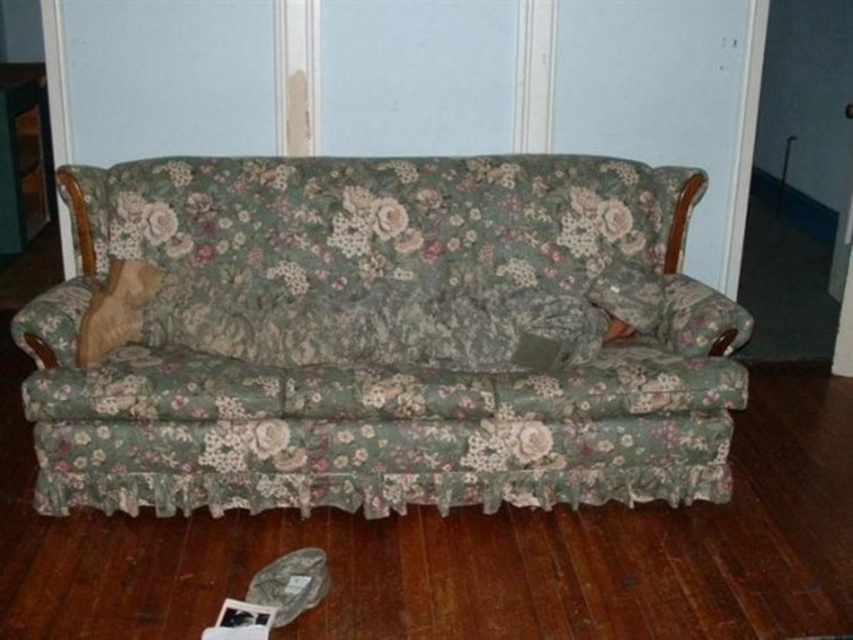
Question: Which point is farther from the camera taking this photo?

Choices:
 (A) (140, 278)
 (B) (384, 228)
 (C) (654, 321)

Answer: (B)

Question: Does floral fabric couch at center have a larger size compared to wooden pillow at left?

Choices:
 (A) yes
 (B) no

Answer: (A)

Question: Where is floral fabric couch at center located in relation to floral fabric pillow at center in the image?

Choices:
 (A) above
 (B) below

Answer: (B)

Question: Which object is the closest to the floral fabric couch at center?

Choices:
 (A) wooden pillow at left
 (B) floral fabric pillow at center

Answer: (A)

Question: Does floral fabric couch at center come in front of floral fabric pillow at center?

Choices:
 (A) yes
 (B) no

Answer: (A)

Question: Which object is closer to the camera taking this photo?

Choices:
 (A) floral fabric couch at center
 (B) wooden pillow at left

Answer: (A)